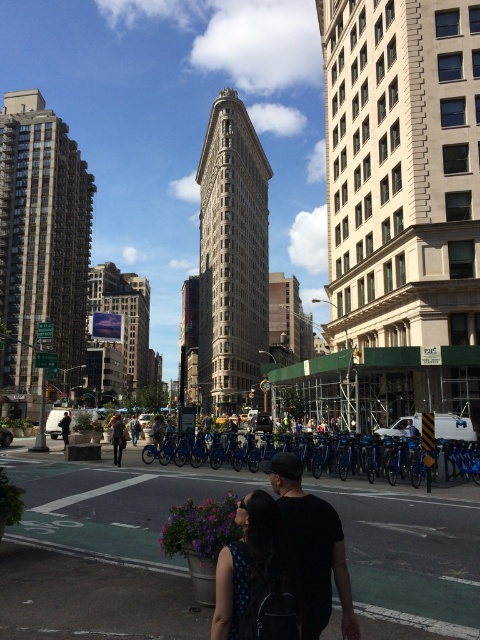
Question: Can you confirm if black fabric backpack at center is positioned above black matte shirt at center?

Choices:
 (A) no
 (B) yes

Answer: (B)

Question: Which of these objects is positioned closest to the black leather jacket at left?

Choices:
 (A) dark brown leather jacket at center
 (B) black fabric backpack at center

Answer: (A)

Question: Observing the image, what is the correct spatial positioning of black matte shirt at center in reference to black leather jacket at left?

Choices:
 (A) left
 (B) right

Answer: (B)

Question: In this image, where is black fabric backpack at center located relative to black leather jacket at left?

Choices:
 (A) above
 (B) below

Answer: (A)

Question: Which point appears farthest from the camera in this image?

Choices:
 (A) (64, 435)
 (B) (332, 560)
 (C) (118, 452)
 (D) (285, 548)

Answer: (A)

Question: Which is nearer to the black leather jacket at left?

Choices:
 (A) black fabric backpack at center
 (B) dark brown leather jacket at center
 (C) black matte shirt at center

Answer: (B)